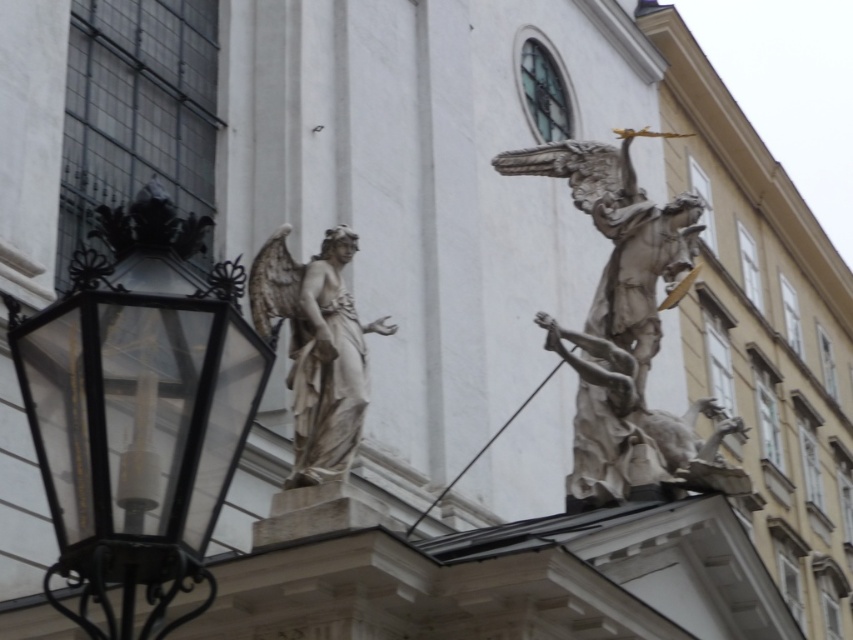
Question: Does black glass lantern at left appear on the left side of white marble sculpture at upper right?

Choices:
 (A) yes
 (B) no

Answer: (A)

Question: Does white marble sculpture at upper right come in front of white marble statue at center?

Choices:
 (A) yes
 (B) no

Answer: (B)

Question: Which object appears closest to the camera in this image?

Choices:
 (A) smooth white bird at center
 (B) white marble sculpture at upper right
 (C) white marble statue at center
 (D) black glass lantern at left

Answer: (D)

Question: In this image, where is white marble statue at center located relative to smooth white bird at center?

Choices:
 (A) below
 (B) above

Answer: (A)

Question: Which object is closer to the camera taking this photo?

Choices:
 (A) white marble statue at center
 (B) black glass lantern at left
 (C) smooth white bird at center
 (D) white marble sculpture at upper right

Answer: (B)

Question: Which point is farther to the camera?

Choices:
 (A) (314, 419)
 (B) (317, 129)

Answer: (B)